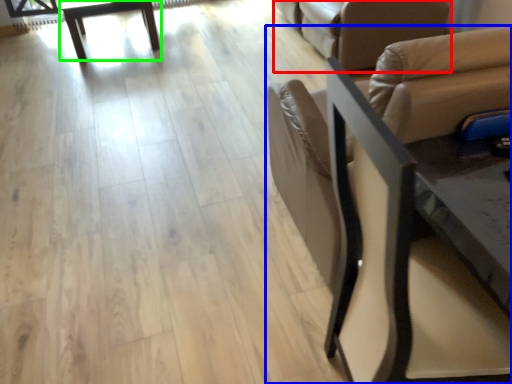
Question: Based on their relative distances, which object is farther from futon (highlighted by a red box)? Choose from chair (highlighted by a blue box) and table (highlighted by a green box).

Choices:
 (A) chair
 (B) table

Answer: (B)